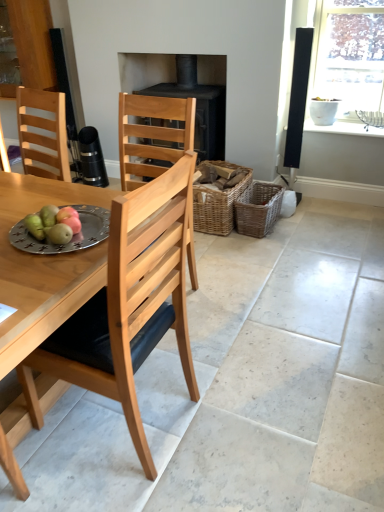
Question: Is black matte fireplace at center taller than natural wood chair at center?

Choices:
 (A) no
 (B) yes

Answer: (A)

Question: From a real-world perspective, is black matte fireplace at center physically above natural wood chair at center?

Choices:
 (A) yes
 (B) no

Answer: (A)

Question: From a real-world perspective, does black matte fireplace at center sit lower than natural wood chair at center?

Choices:
 (A) no
 (B) yes

Answer: (A)

Question: From the image's perspective, would you say black matte fireplace at center is shown under natural wood chair at center?

Choices:
 (A) yes
 (B) no

Answer: (B)

Question: Is black matte fireplace at center thinner than natural wood chair at center?

Choices:
 (A) no
 (B) yes

Answer: (B)

Question: Does point (69, 243) appear closer or farther from the camera than point (253, 194)?

Choices:
 (A) closer
 (B) farther

Answer: (A)

Question: From their relative heights in the image, would you say silver metallic plate at table left is taller or shorter than woven brown basket at center-right, arranged as the second basket when viewed from the left?

Choices:
 (A) tall
 (B) short

Answer: (B)

Question: From a real-world perspective, is silver metallic plate at table left physically located above or below woven brown basket at center-right, arranged as the second basket when viewed from the left?

Choices:
 (A) above
 (B) below

Answer: (A)

Question: Looking at the image, does silver metallic plate at table left seem bigger or smaller compared to woven brown basket at center-right, arranged as the second basket when viewed from the left?

Choices:
 (A) big
 (B) small

Answer: (B)

Question: From the image's perspective, is woven brown basket at center-right, acting as the 1th basket starting from the right, positioned above or below silver metallic plate at table left?

Choices:
 (A) above
 (B) below

Answer: (A)

Question: Considering their positions, is woven brown basket at center-right, acting as the 1th basket starting from the right, located in front of or behind silver metallic plate at table left?

Choices:
 (A) behind
 (B) front

Answer: (A)

Question: Is woven brown basket at center-right, arranged as the second basket when viewed from the left, to the left or to the right of silver metallic plate at table left in the image?

Choices:
 (A) right
 (B) left

Answer: (A)

Question: From a real-world perspective, relative to silver metallic plate at table left, is woven brown basket at center-right, acting as the 1th basket starting from the right, vertically above or below?

Choices:
 (A) above
 (B) below

Answer: (B)

Question: Is woven brown basket at center, the 1th basket positioned from the left, wider or thinner than silver metallic plate at table left?

Choices:
 (A) wide
 (B) thin

Answer: (A)

Question: Considering the positions of woven brown basket at center, the 1th basket positioned from the left, and silver metallic plate at table left in the image, is woven brown basket at center, the 1th basket positioned from the left, bigger or smaller than silver metallic plate at table left?

Choices:
 (A) small
 (B) big

Answer: (B)